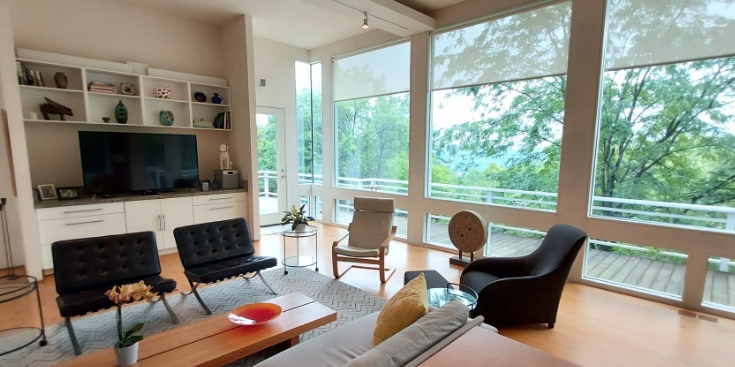
The image size is (735, 367). I want to click on glass, so click(x=359, y=137), click(x=451, y=142), click(x=650, y=161), click(x=262, y=147).